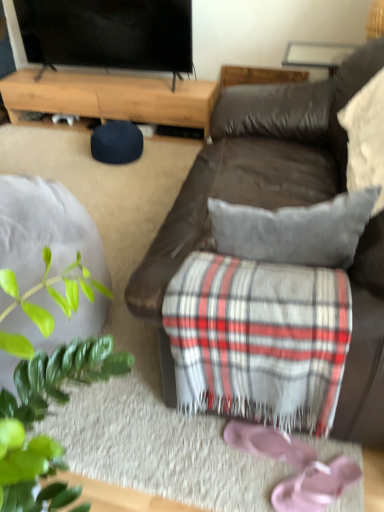
This screenshot has width=384, height=512. I want to click on vacant area on top of pink fabric flip-flops at lower right (from a real-world perspective), so click(x=304, y=489).